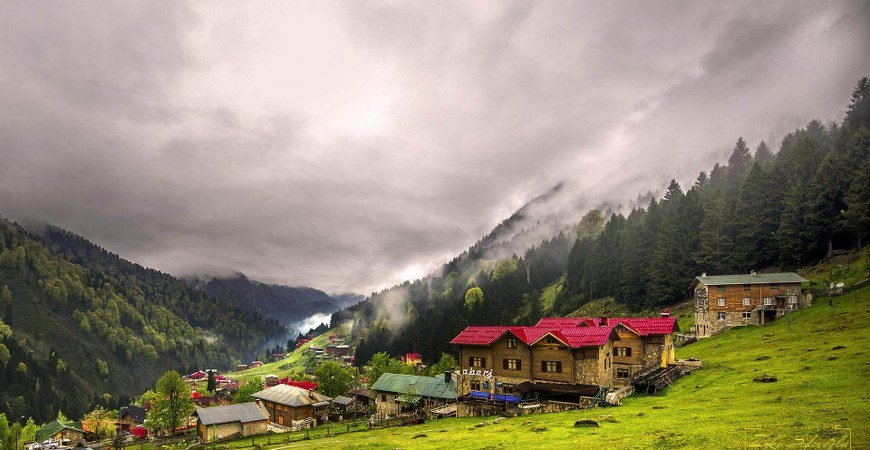
The height and width of the screenshot is (450, 870). Identify the location of windows. (549, 368), (507, 365), (470, 362), (626, 351).